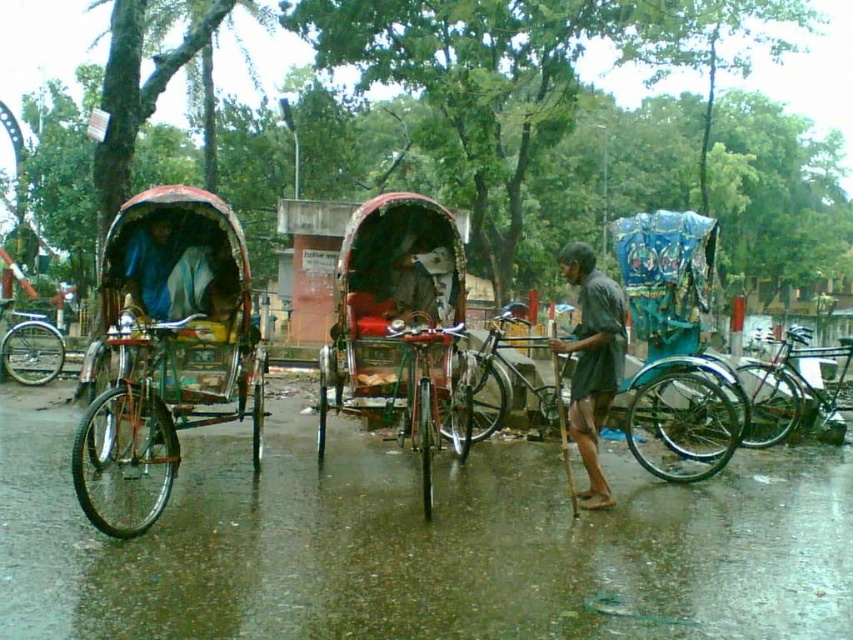
Who is positioned more to the left, metallic red rickshaw at left or red fabric rickshaw at center?

metallic red rickshaw at left is more to the left.

Does metallic red rickshaw at left have a greater height compared to red fabric rickshaw at center?

Yes.

You are a GUI agent. You are given a task and a screenshot of the screen. Output one action in this format:
    pyautogui.click(x=<x>, y=<y>)
    Task: Click on the metallic red rickshaw at left
    The image size is (853, 640).
    Given the screenshot: What is the action you would take?
    pyautogui.click(x=189, y=300)

In order to click on metallic red rickshaw at left in this screenshot , I will do `click(189, 300)`.

Does metallic red rickshaw at left have a smaller size compared to orange metallic bicycle at left?

Actually, metallic red rickshaw at left might be larger than orange metallic bicycle at left.

Is metallic red rickshaw at left below orange metallic bicycle at left?

Incorrect, metallic red rickshaw at left is not positioned below orange metallic bicycle at left.

The width and height of the screenshot is (853, 640). What do you see at coordinates (189, 300) in the screenshot?
I see `metallic red rickshaw at left` at bounding box center [189, 300].

Locate an element on the screen. The width and height of the screenshot is (853, 640). metallic red rickshaw at left is located at coordinates (189, 300).

Does point (413, 392) come behind point (25, 369)?

That is False.

Who is positioned more to the left, shiny metallic bicycle at center or silver metallic bicycle at left?

silver metallic bicycle at left is more to the left.

Locate an element on the screen. The image size is (853, 640). shiny metallic bicycle at center is located at coordinates (432, 392).

You are a GUI agent. You are given a task and a screenshot of the screen. Output one action in this format:
    pyautogui.click(x=<x>, y=<y>)
    Task: Click on the shiny metallic bicycle at center
    This screenshot has width=853, height=640.
    Given the screenshot: What is the action you would take?
    pyautogui.click(x=432, y=392)